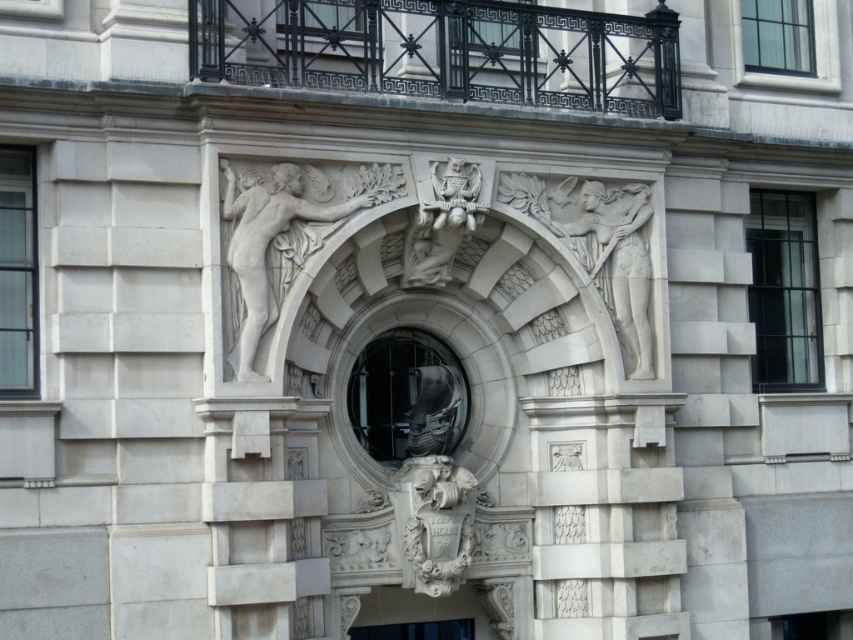
You are standing in front of the building and want to take a photo of the white marble cherub at upper left. Considering the distance, can you capture it clearly in your smartphone camera without zooming in?

The white marble cherub at upper left is 27.35 meters away from the viewer. Since smartphones typically have limited zoom capabilities, capturing it clearly without zooming may result in a small or blurry image. It is recommended to move closer or use zoom for a better shot.

You are an architect designing a new building and want to place a decorative element at point (440, 221). Is there already an object at that location in the current design?

Yes, there is a white stone eagle at center located at point (440, 221).

You are an architect designing a scale model of this building facade. The white marble cherub at upper left is located at coordinates point 0.388, 0.321. If your model uses a coordinate system where the bottom left corner is the origin, will the cherub be closer to the top or bottom edge of the model?

The position of the white marble cherub at upper left is at point [273,243]. In a coordinate system with the origin at the bottom left corner, the y coordinate determines vertical position. Since the y value is 0.321, which is less than 0.5, the cherub is closer to the bottom edge of the model.